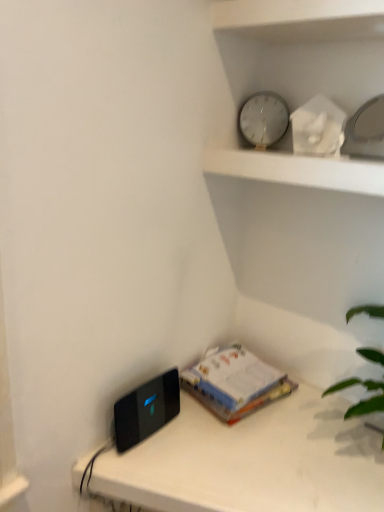
In order to click on empty space that is ontop of black plastic device at lower left (from a real-world perspective) in this screenshot , I will do `click(233, 454)`.